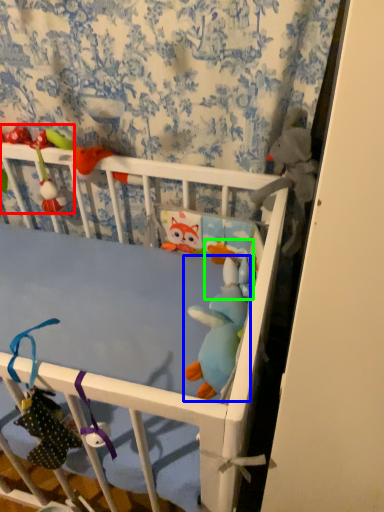
Question: Based on their relative distances, which object is farther from toy (highlighted by a red box)? Choose from toy (highlighted by a blue box) and toy (highlighted by a green box).

Choices:
 (A) toy
 (B) toy

Answer: (A)